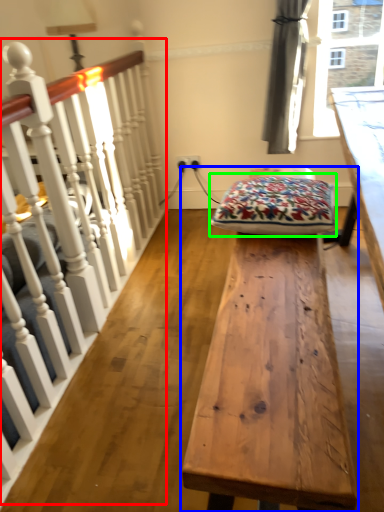
Question: Based on their relative distances, which object is farther from rail (highlighted by a red box)? Choose from table (highlighted by a blue box) and blanket (highlighted by a green box).

Choices:
 (A) table
 (B) blanket

Answer: (A)